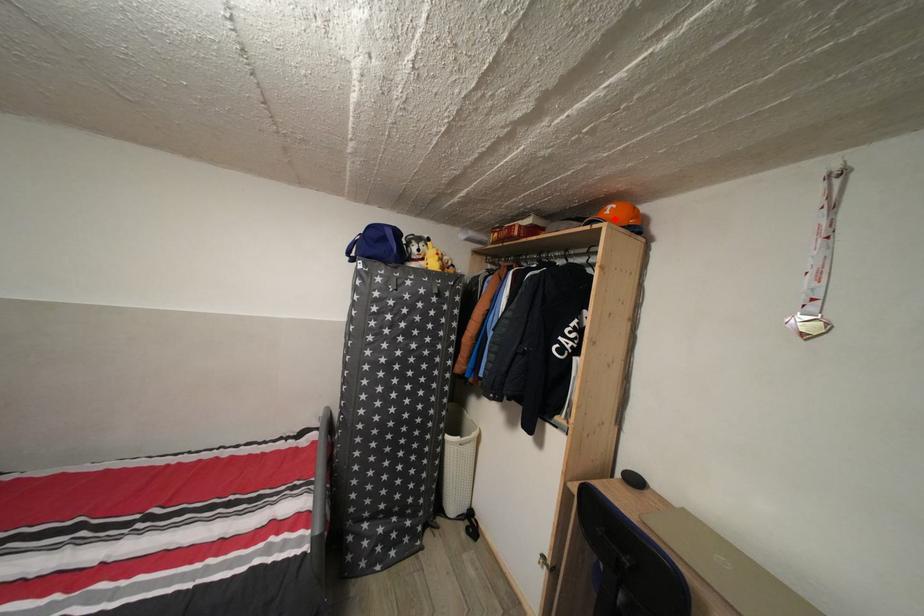
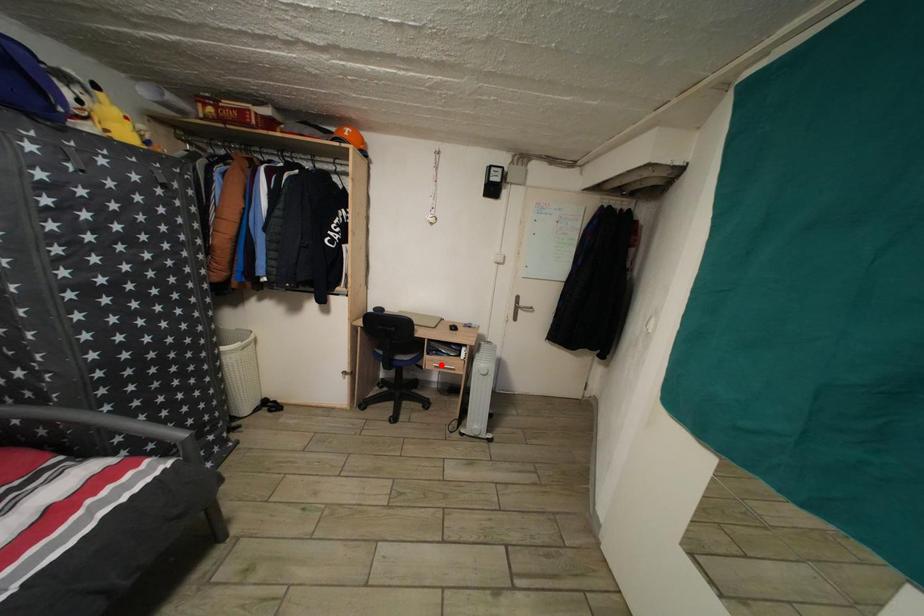
I am providing you with two images of the same scene from different viewpoints. A red point is marked on the first image and another point is marked on the second image. Are the points marked in image1 and image2 representing the same 3D position?

No